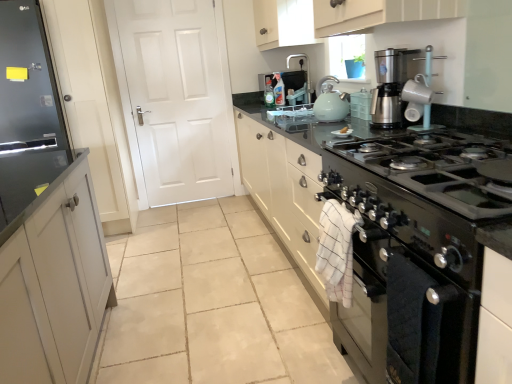
Question: From a real-world perspective, is matte white mug at upper right beneath matte teal kettle at upper center?

Choices:
 (A) no
 (B) yes

Answer: (A)

Question: Is matte white mug at upper right wider than matte teal kettle at upper center?

Choices:
 (A) yes
 (B) no

Answer: (B)

Question: From a real-world perspective, is matte white mug at upper right positioned over matte teal kettle at upper center based on gravity?

Choices:
 (A) yes
 (B) no

Answer: (A)

Question: Does matte white mug at upper right have a smaller size compared to matte teal kettle at upper center?

Choices:
 (A) yes
 (B) no

Answer: (B)

Question: From the image's perspective, is matte white mug at upper right on top of matte teal kettle at upper center?

Choices:
 (A) yes
 (B) no

Answer: (B)

Question: From a real-world perspective, relative to matte teal kettle at upper center, is white glossy plate at center vertically above or below?

Choices:
 (A) above
 (B) below

Answer: (B)

Question: From the image's perspective, is white glossy plate at center above or below matte teal kettle at upper center?

Choices:
 (A) below
 (B) above

Answer: (A)

Question: In the image, is white glossy plate at center on the left side or the right side of matte teal kettle at upper center?

Choices:
 (A) left
 (B) right

Answer: (A)

Question: Looking at the image, does white glossy plate at center seem bigger or smaller compared to matte teal kettle at upper center?

Choices:
 (A) big
 (B) small

Answer: (B)

Question: Is point (422, 336) closer or farther from the camera than point (393, 62)?

Choices:
 (A) farther
 (B) closer

Answer: (B)

Question: Would you say black stainless steel oven at lower right is inside or outside matte white mug at upper right?

Choices:
 (A) outside
 (B) inside

Answer: (A)

Question: Is black stainless steel oven at lower right wider or thinner than matte white mug at upper right?

Choices:
 (A) thin
 (B) wide

Answer: (B)

Question: In the image, is black stainless steel oven at lower right positioned in front of or behind matte white mug at upper right?

Choices:
 (A) front
 (B) behind

Answer: (A)

Question: From the image's perspective, is black glass stove at center located above or below blue plastic pot at upper center?

Choices:
 (A) above
 (B) below

Answer: (B)

Question: Choose the correct answer: Is black glass stove at center inside blue plastic pot at upper center or outside it?

Choices:
 (A) inside
 (B) outside

Answer: (B)